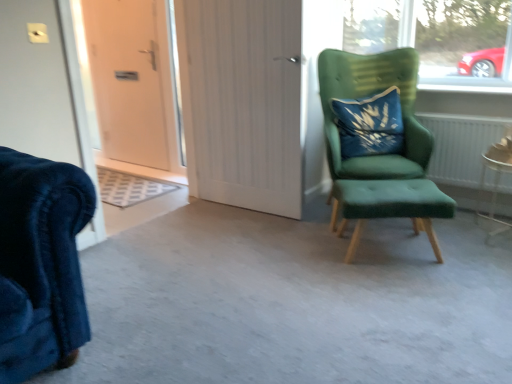
Question: Is white wood door at center, which ranks as the first door in right-to-left order, wider than blue velvet pillow at upper right?

Choices:
 (A) yes
 (B) no

Answer: (B)

Question: Is white wood door at center, acting as the 1th door starting from the front, turned away from blue velvet pillow at upper right?

Choices:
 (A) no
 (B) yes

Answer: (A)

Question: Is white wood door at center, marked as the 2th door in a back-to-front arrangement, bigger than blue velvet pillow at upper right?

Choices:
 (A) no
 (B) yes

Answer: (B)

Question: Is the depth of white wood door at center, marked as the 2th door in a back-to-front arrangement, greater than that of blue velvet pillow at upper right?

Choices:
 (A) no
 (B) yes

Answer: (A)

Question: Is white wood door at center, marked as the 2th door in a back-to-front arrangement, oriented towards blue velvet pillow at upper right?

Choices:
 (A) no
 (B) yes

Answer: (A)

Question: Visually, is white wood door at center, marked as the 2th door in a back-to-front arrangement, positioned to the left or to the right of white textured radiator at right?

Choices:
 (A) right
 (B) left

Answer: (B)

Question: Is white wood door at center, acting as the 1th door starting from the front, wider or thinner than white textured radiator at right?

Choices:
 (A) thin
 (B) wide

Answer: (A)

Question: Is white wood door at center, marked as the 2th door in a back-to-front arrangement, taller or shorter than white textured radiator at right?

Choices:
 (A) tall
 (B) short

Answer: (A)

Question: From the image's perspective, is white wood door at center, which ranks as the first door in right-to-left order, above or below white textured radiator at right?

Choices:
 (A) below
 (B) above

Answer: (B)

Question: From their relative heights in the image, would you say green fabric stool at right is taller or shorter than white wood door at center, marked as the 2th door in a back-to-front arrangement?

Choices:
 (A) short
 (B) tall

Answer: (A)

Question: From the image's perspective, is green fabric stool at right located above or below white wood door at center, acting as the 1th door starting from the front?

Choices:
 (A) above
 (B) below

Answer: (B)

Question: Is green fabric stool at right wider or thinner than white wood door at center, which ranks as the first door in right-to-left order?

Choices:
 (A) thin
 (B) wide

Answer: (B)

Question: From a real-world perspective, relative to white wood door at center, marked as the 2th door in a back-to-front arrangement, is green fabric stool at right vertically above or below?

Choices:
 (A) above
 (B) below

Answer: (B)

Question: Would you say white textured radiator at right is to the left or to the right of white wood door at center, which ranks as the first door in right-to-left order, in the picture?

Choices:
 (A) left
 (B) right

Answer: (B)

Question: Which is correct: white textured radiator at right is inside white wood door at center, marked as the 2th door in a back-to-front arrangement, or outside of it?

Choices:
 (A) inside
 (B) outside

Answer: (B)